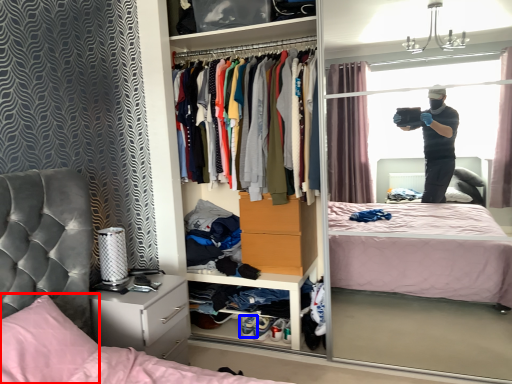
Question: Which of the following is the farthest to the observer, pillow (highlighted by a red box) or footwear (highlighted by a blue box)?

Choices:
 (A) pillow
 (B) footwear

Answer: (B)